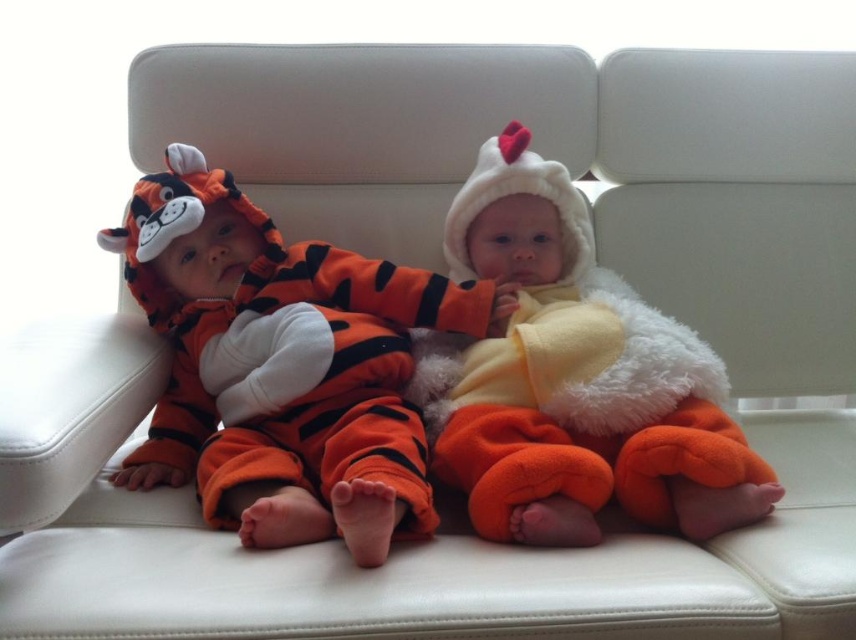
Consider the image. Which is more to the left, orange fuzzy tiger suit at left or fluffy orange chicken at center?

orange fuzzy tiger suit at left is more to the left.

Measure the distance between point (x=284, y=493) and camera.

Point (x=284, y=493) is 35.92 inches away from camera.

You are a GUI agent. You are given a task and a screenshot of the screen. Output one action in this format:
    pyautogui.click(x=<x>, y=<y>)
    Task: Click on the orange fuzzy tiger suit at left
    Image resolution: width=856 pixels, height=640 pixels.
    Given the screenshot: What is the action you would take?
    click(283, 365)